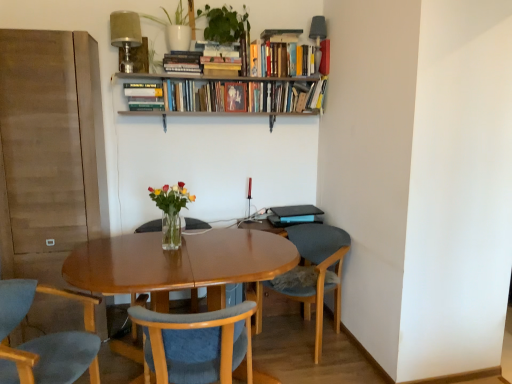
Question: In which direction should I rotate to look at hardcover books at upper center, which is counted as the fourth book, starting from the left?

Choices:
 (A) right
 (B) left

Answer: (B)

Question: Does hardcover books at upper center, which is counted as the fourth book, starting from the left, have a lesser width compared to satin beige lampshade at upper center?

Choices:
 (A) no
 (B) yes

Answer: (B)

Question: Is satin beige lampshade at upper center inside hardcover books at upper center, the 3th book in the right-to-left sequence?

Choices:
 (A) yes
 (B) no

Answer: (B)

Question: Is hardcover books at upper center, the 3th book in the right-to-left sequence, positioned before satin beige lampshade at upper center?

Choices:
 (A) yes
 (B) no

Answer: (B)

Question: Is hardcover books at upper center, the 3th book in the right-to-left sequence, positioned far away from satin beige lampshade at upper center?

Choices:
 (A) no
 (B) yes

Answer: (A)

Question: Does hardcover books at upper center, which is counted as the fourth book, starting from the left, come behind satin beige lampshade at upper center?

Choices:
 (A) no
 (B) yes

Answer: (B)

Question: From the image's perspective, would you say hardcover books at upper center, the 3th book in the right-to-left sequence, is positioned over satin beige lampshade at upper center?

Choices:
 (A) no
 (B) yes

Answer: (A)

Question: From the image's perspective, is matte black photo frame at upper center, the third book in the left-to-right sequence, below hardcover books at upper center, the 3th book in the right-to-left sequence?

Choices:
 (A) no
 (B) yes

Answer: (B)

Question: Does matte black photo frame at upper center, which is counted as the fourth book, starting from the right, have a greater width compared to hardcover books at upper center, which is counted as the fourth book, starting from the left?

Choices:
 (A) no
 (B) yes

Answer: (A)

Question: Is matte black photo frame at upper center, which is counted as the fourth book, starting from the right, positioned with its back to hardcover books at upper center, the 3th book in the right-to-left sequence?

Choices:
 (A) yes
 (B) no

Answer: (A)

Question: Does matte black photo frame at upper center, which is counted as the fourth book, starting from the right, turn towards hardcover books at upper center, which is counted as the fourth book, starting from the left?

Choices:
 (A) no
 (B) yes

Answer: (B)

Question: Is matte black photo frame at upper center, which is counted as the fourth book, starting from the right, touching hardcover books at upper center, which is counted as the fourth book, starting from the left?

Choices:
 (A) no
 (B) yes

Answer: (A)

Question: Does matte black photo frame at upper center, the third book in the left-to-right sequence, have a lesser height compared to hardcover books at upper center, which is counted as the fourth book, starting from the left?

Choices:
 (A) no
 (B) yes

Answer: (B)

Question: From a real-world perspective, is blue fabric chair at lower left, acting as the first chair starting from the left, over translucent glass vase at center?

Choices:
 (A) no
 (B) yes

Answer: (A)